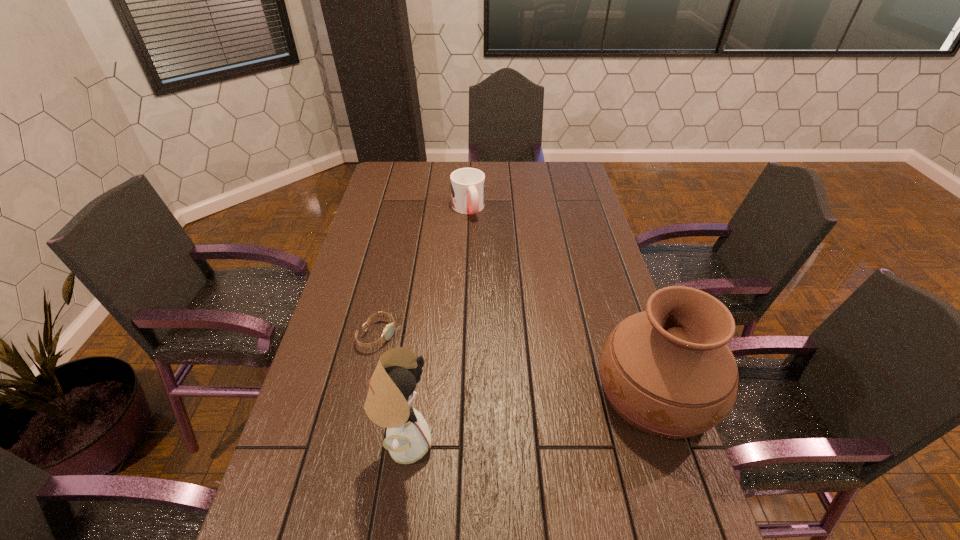
You are a GUI agent. You are given a task and a screenshot of the screen. Output one action in this format:
    pyautogui.click(x=<x>, y=<y>)
    Task: Click on the free spot that satisfies the following two spatial constraints: 1. on the front side of the farthest object; 2. on the left side of the rightmost object
    This screenshot has height=540, width=960.
    Given the screenshot: What is the action you would take?
    (462, 392)